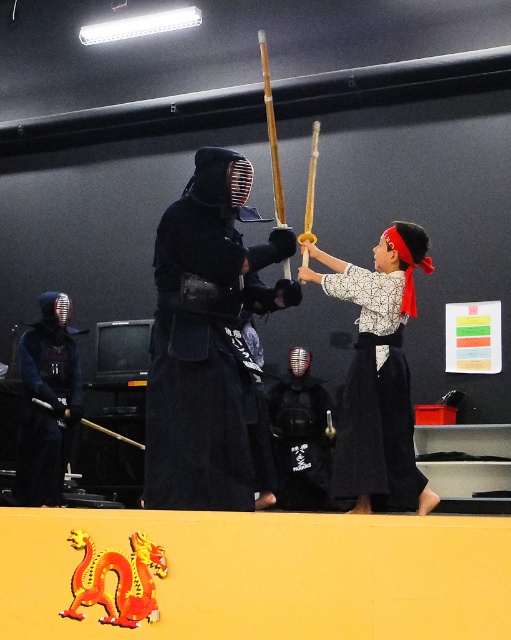
Does white cotton kimono at center have a smaller size compared to matte black kendo helmet at left?

No, white cotton kimono at center is not smaller than matte black kendo helmet at left.

Does white cotton kimono at center appear under matte black kendo helmet at left?

No, white cotton kimono at center is not below matte black kendo helmet at left.

Is point (356, 298) in front of point (58, 448)?

Yes, point (356, 298) is in front of point (58, 448).

This screenshot has height=640, width=511. Identify the location of white cotton kimono at center. (376, 397).

Is black matte kimono at center positioned before white cotton kimono at center?

Yes.

Between point (233, 248) and point (369, 496), which one is positioned in front?

Point (233, 248) is in front.

The image size is (511, 640). Identify the location of black matte kimono at center. (206, 362).

Which is more to the right, black matte kimono at center or matte black kendo helmet at left?

black matte kimono at center

Is point (193, 364) more distant than point (16, 452)?

No, (193, 364) is in front of (16, 452).

The image size is (511, 640). I want to click on black matte kimono at center, so click(206, 362).